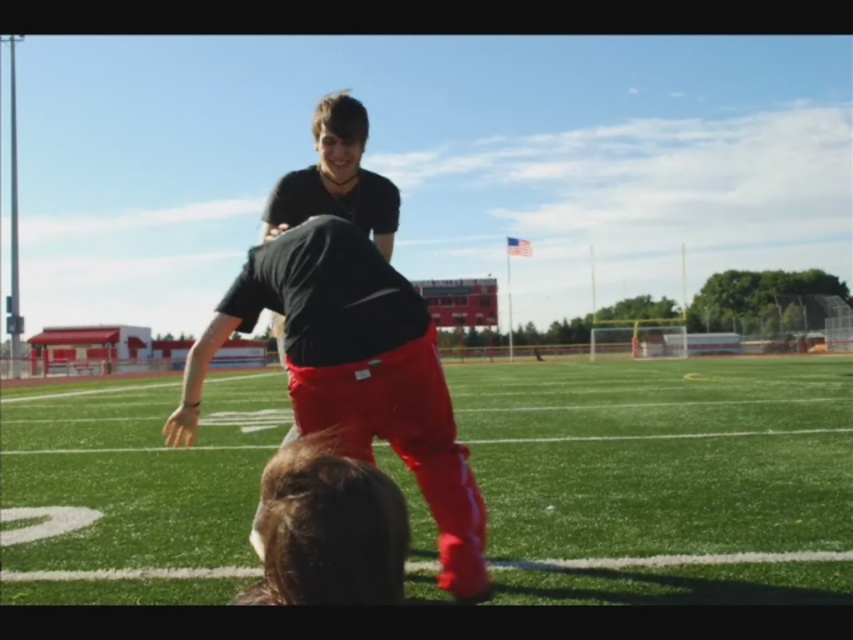
You are a photographer standing at the edge of the football field. You want to take a photo that includes both point [813,465] and point [320,221]. Which point will appear closer to the bottom of the photo?

Point [320,221] will appear closer to the bottom of the photo because it is closer to the camera than point [813,465].

You are a photographer standing at the edge of the green grass football field at center. You want to take a picture of the matte black shirt at center. Since the football field is below the shirt, where should you position your camera to capture both the shirt and the field in the frame?

Since the green grass football field at center is located below the matte black shirt at center, you should position your camera at a lower angle to include both the matte black shirt at center and the field in the frame.

You are a photographer standing at the edge of the green grass football field at center and the matte black shirt at center. You want to take a photo that includes both objects. Which object should you position closer to the left side of the camera frame to ensure both are visible?

The matte black shirt at center should be positioned closer to the left side of the camera frame because the green grass football field at center is already on its right side, so moving the black shirt to the left will keep both within the frame.